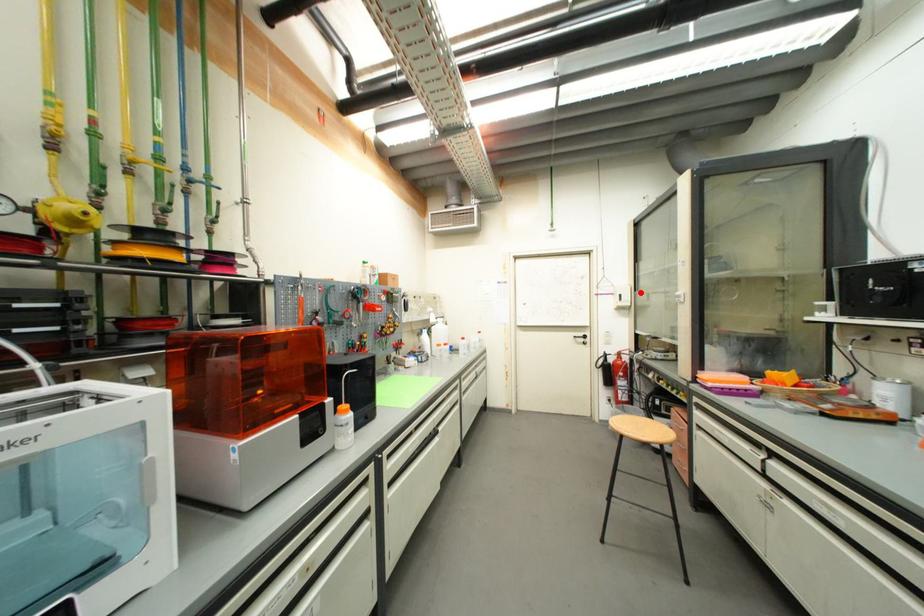
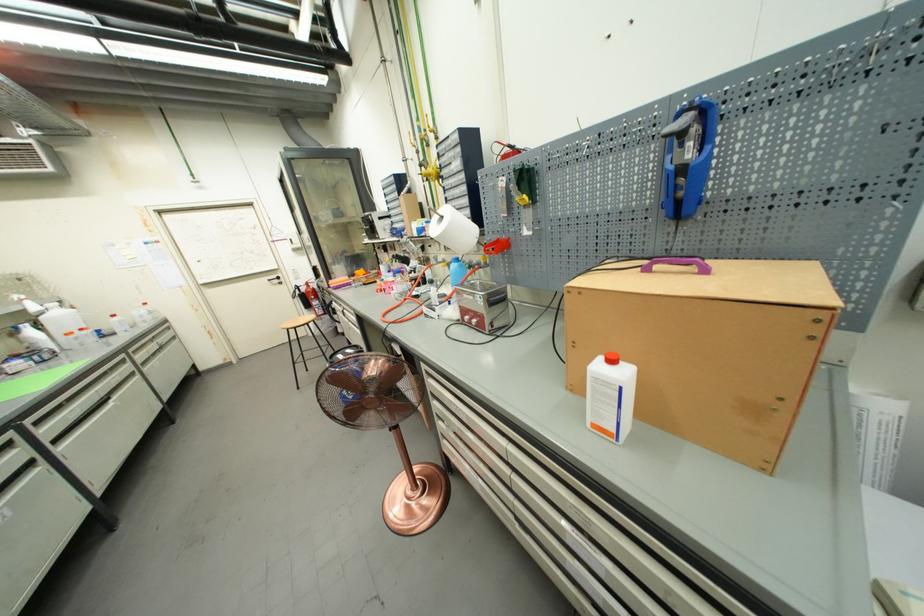
Locate, in the second image, the point that corresponds to the highlighted location in the first image.

(306, 237)